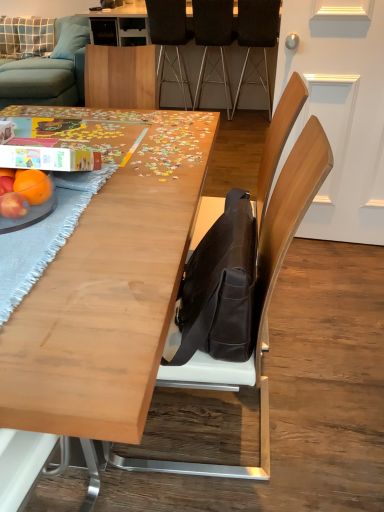
Locate an element on the screen. The image size is (384, 512). empty space that is to the right of brown leather chair at center, which is the 4th chair from back to front is located at coordinates point(329,406).